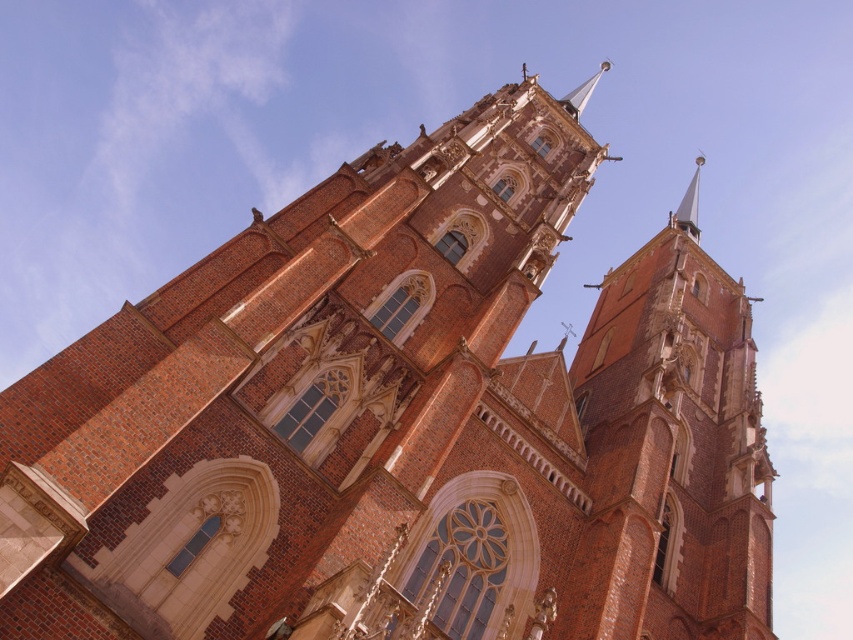
Looking at this image, who is higher up, matte brick tower at right or smooth gold spire at upper right?

smooth gold spire at upper right is higher up.

Which is below, matte brick tower at right or smooth gold spire at upper right?

matte brick tower at right is below.

Is point (703, 520) farther from camera compared to point (683, 228)?

No, it is in front of (683, 228).

Identify the location of matte brick tower at right. (670, 456).